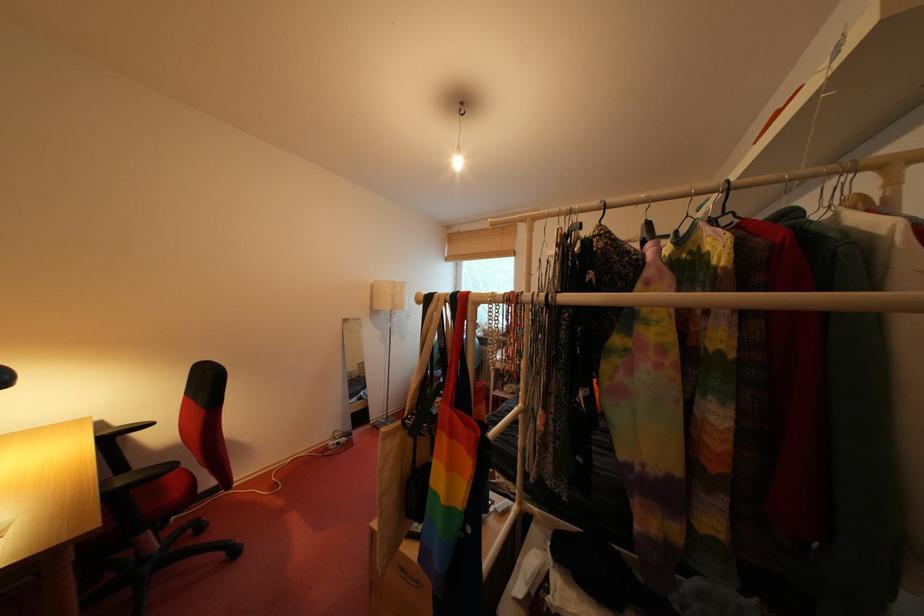
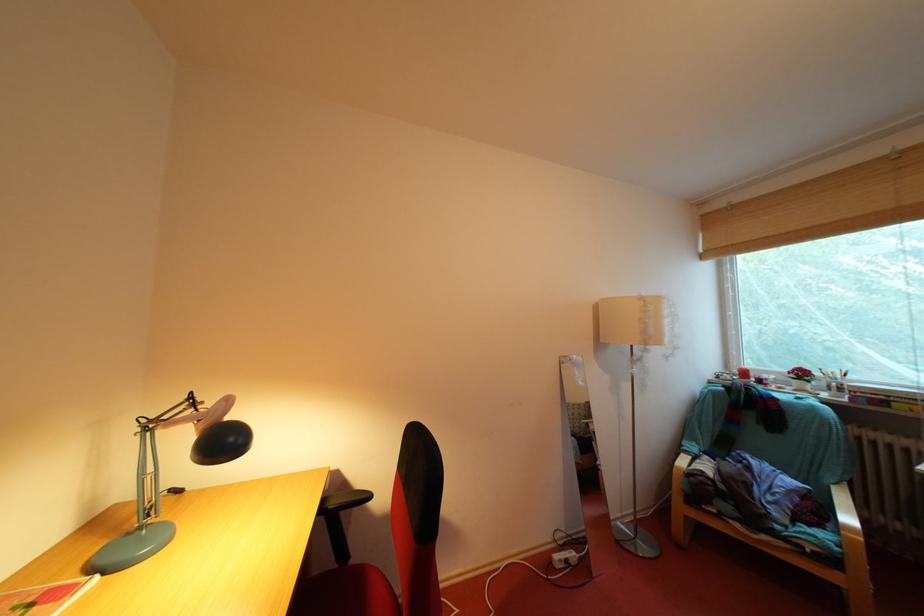
Locate, in the second image, the point that corresponds to point 116,437 in the first image.

(342, 508)